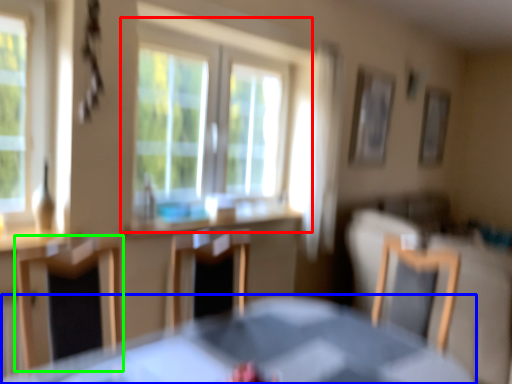
Question: Which object is the farthest from window (highlighted by a red box)? Choose among these: table (highlighted by a blue box) or chair (highlighted by a green box).

Choices:
 (A) table
 (B) chair

Answer: (A)